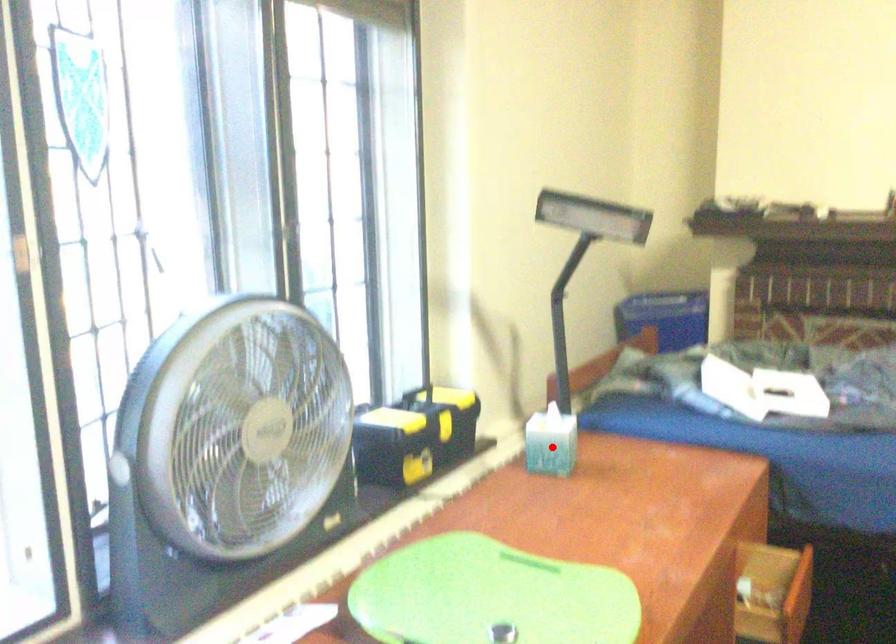
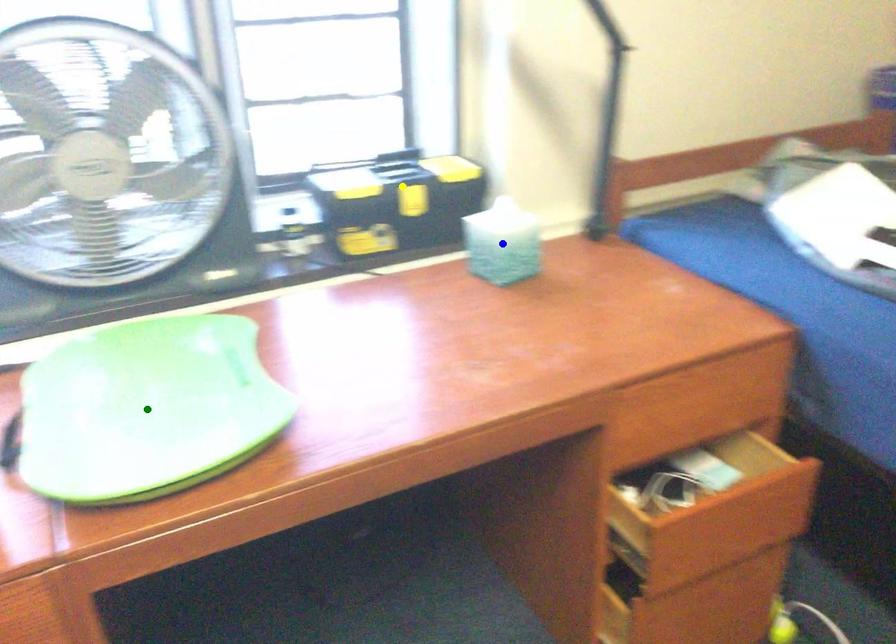
Question: I am providing you with two images of the same scene from different viewpoints. A red point is marked on the first image. You are given multiple points on the second image. Which spot in image 2 lines up with the point in image 1?

Choices:
 (A) green point
 (B) blue point
 (C) yellow point

Answer: (B)